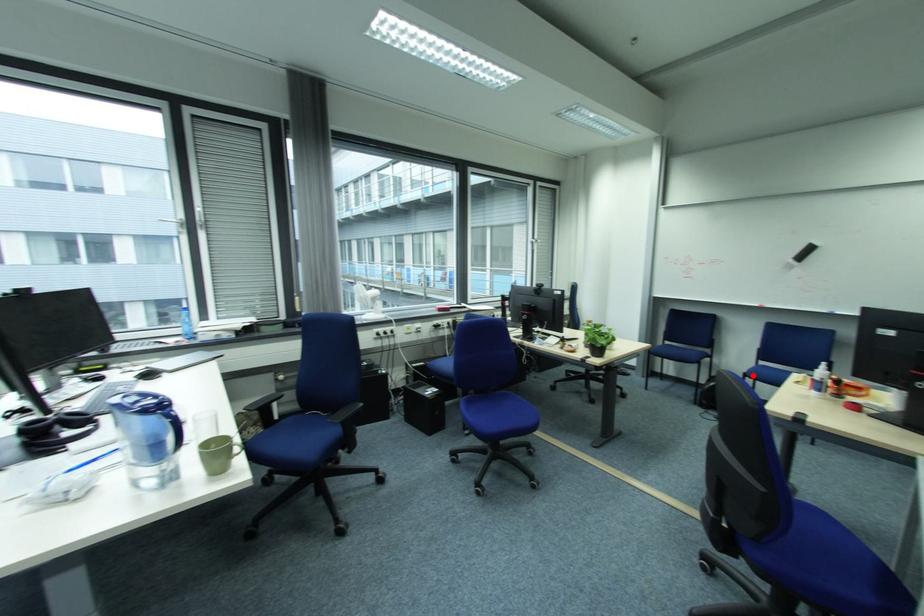
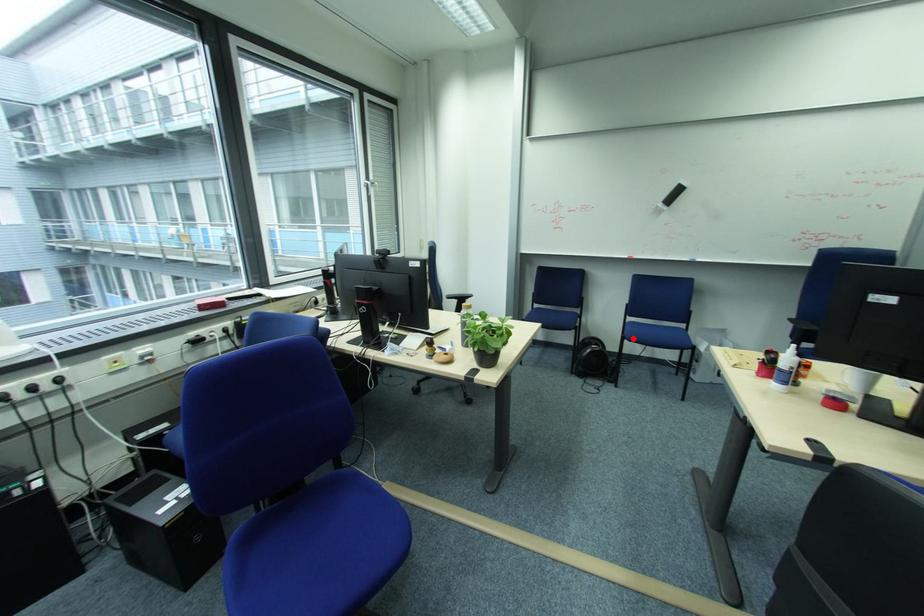
I am providing you with two images of the same scene from different viewpoints. A red point is marked on the first image and another point is marked on the second image. Is the marked point in image1 the same physical position as the marked point in image2?

Yes